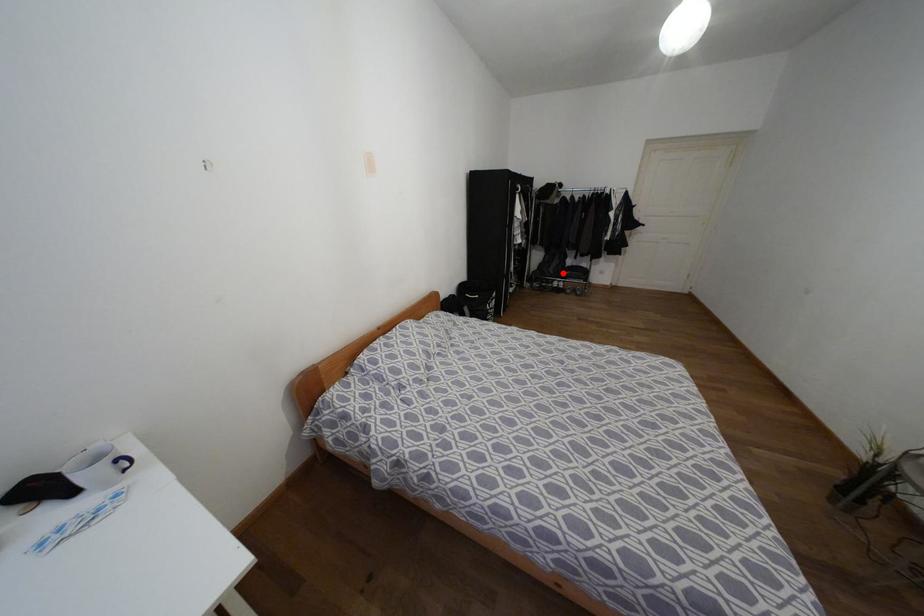
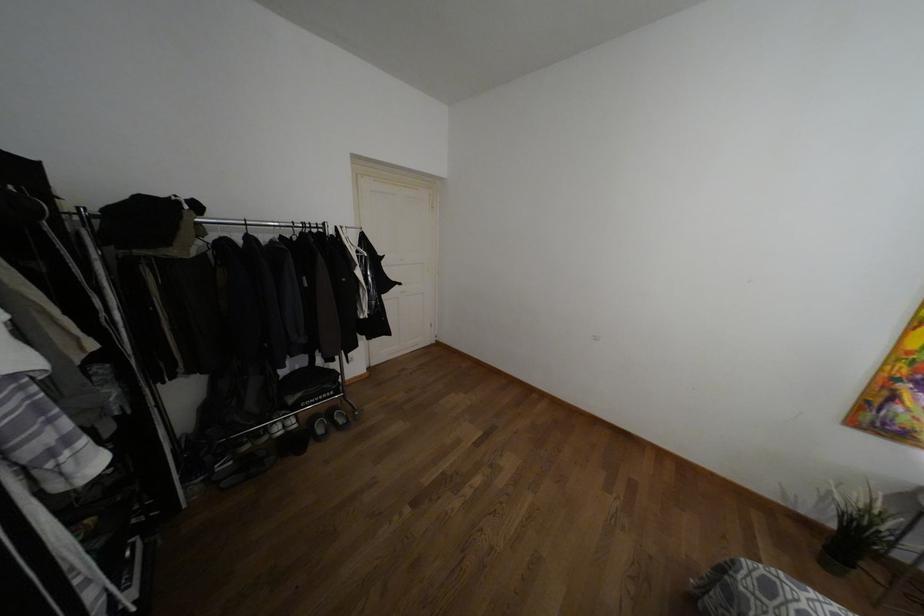
Question: I am providing you with two images of the same scene from different viewpoints. A red point is shown in image1. For the corresponding object point in image2, is it positioned nearer or farther from the camera?

Choices:
 (A) Nearer
 (B) Farther

Answer: (B)